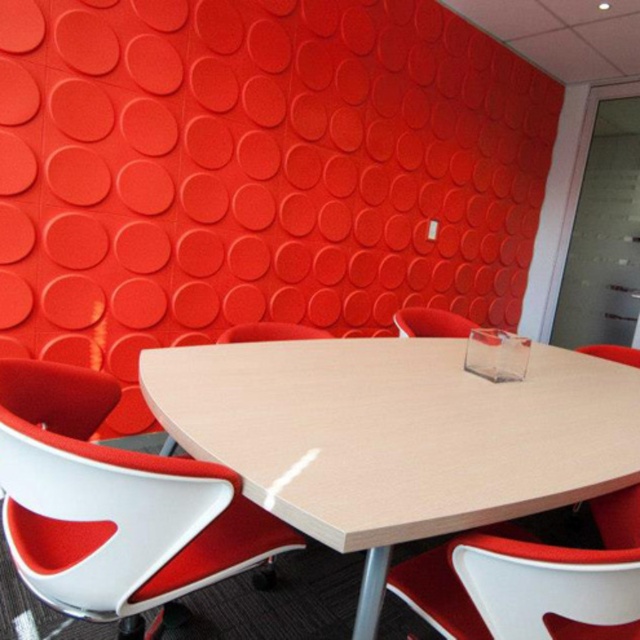
You are organizing a meeting in the room and need to determine the seating arrangement. Which chair, the matte red chair at center or the white matte chair at center, is located to the right when facing the table?

The matte red chair at center is positioned on the right side of white matte chair at center, so when facing the table, the matte red chair at center is to the right of the white matte chair at center.